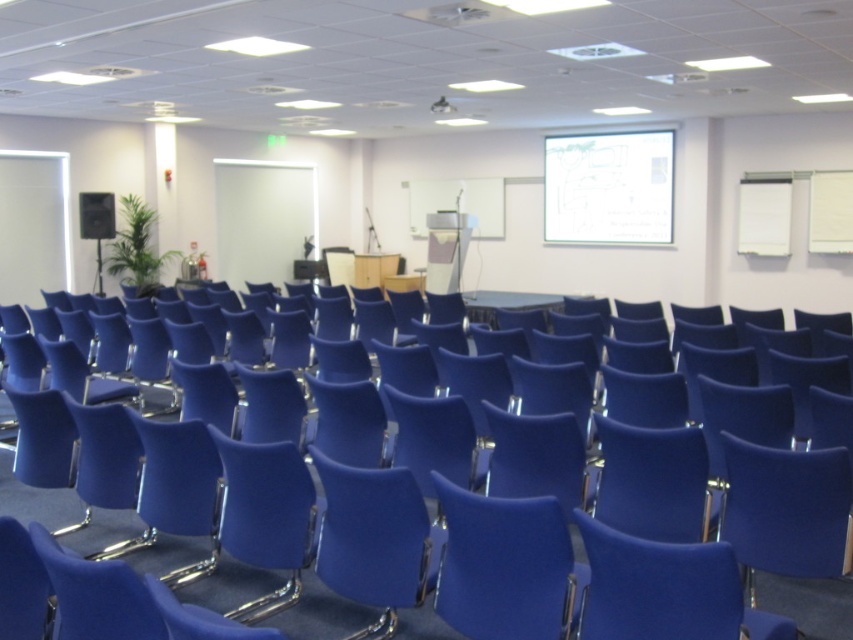
In the scene shown: You are standing in the conference room and want to reach the point marked at coordinates point (442, 499). If your height is 1.7 meters, will you be able to touch the ceiling at that point?

The point (442, 499) is 2.31 meters away from the viewer. Since the ceiling height is not provided in the scene description, we cannot determine if you can touch it.

You are a guest speaker preparing to present in the conference room. You need to choose a chair to sit on during your talk. The blue fabric swivel chair at center and the matte blue chair at center are both available. Which chair would allow you to be seen better by the audience?

The matte blue chair at center is taller than the blue fabric swivel chair at center, so choosing the matte blue chair at center would allow you to be seen better by the audience.

You are organizing a workshop and need to place a 1.2 meter wide table between the blue fabric swivel chair at center and the matte blue chair at center. Can the table fit in the space between them?

The blue fabric swivel chair at center might be wider than matte blue chair at center, so the space between them may not be sufficient to fit a 1.2 meter wide table. Check the actual dimensions before placing the table.